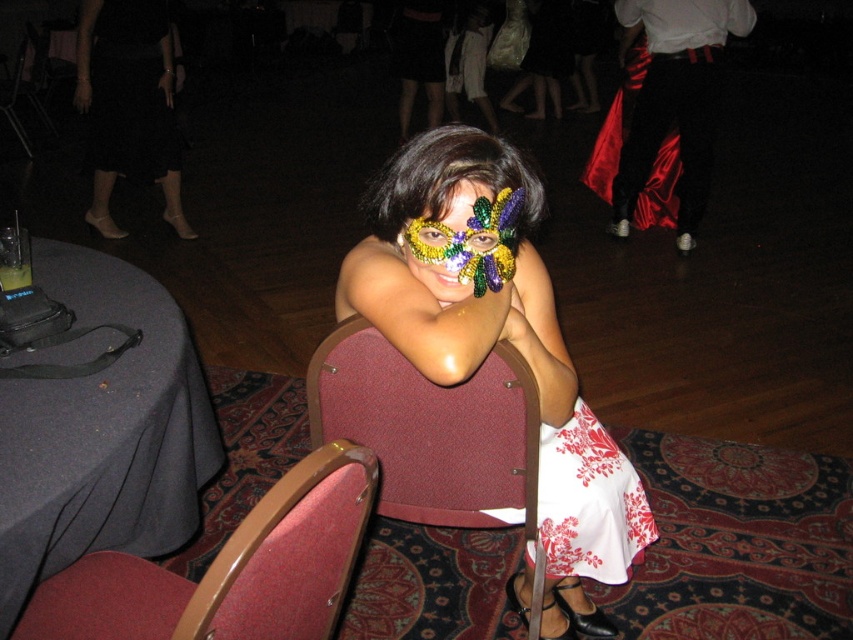
You are standing on the dance floor and see two points marked in the image. Which point is closer to you, point (x=523, y=449) or point (x=506, y=257)?

Point (x=523, y=449) is further to the viewer than point (x=506, y=257), so point (x=506, y=257) is closer to you.

You are a photographer at the party and want to capture the sequined mask at center and the black satin dress at upper left in the same frame. Which object is positioned lower in the image?

The sequined mask at center is positioned below the black satin dress at upper left, so it is lower in the image.

From the picture: You are a photographer at the party and want to take a closeup shot of the sequined mask at center and the black satin dress at upper left. Which object is positioned closer to the front of the image?

The sequined mask at center is closer to the viewer than the black satin dress at upper left, so it is positioned closer to the front of the image.